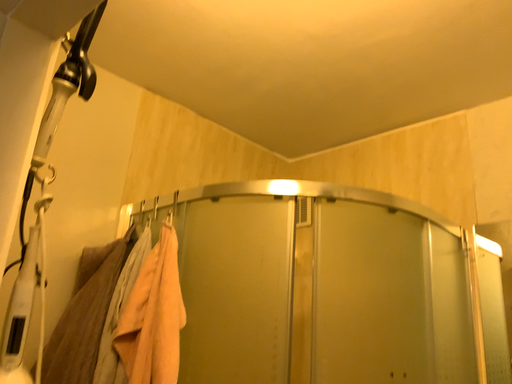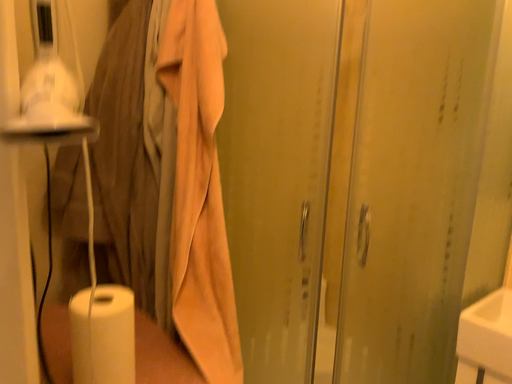
Question: Which way did the camera rotate in the video?

Choices:
 (A) rotated upward
 (B) rotated downward

Answer: (B)